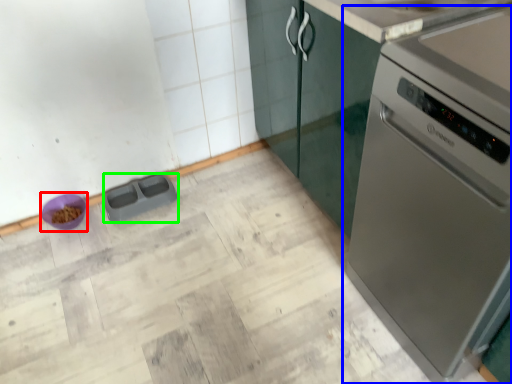
Question: Which is nearer to the appliance (highlighted by a red box)? home appliance (highlighted by a blue box) or appliance (highlighted by a green box).

Choices:
 (A) home appliance
 (B) appliance

Answer: (B)